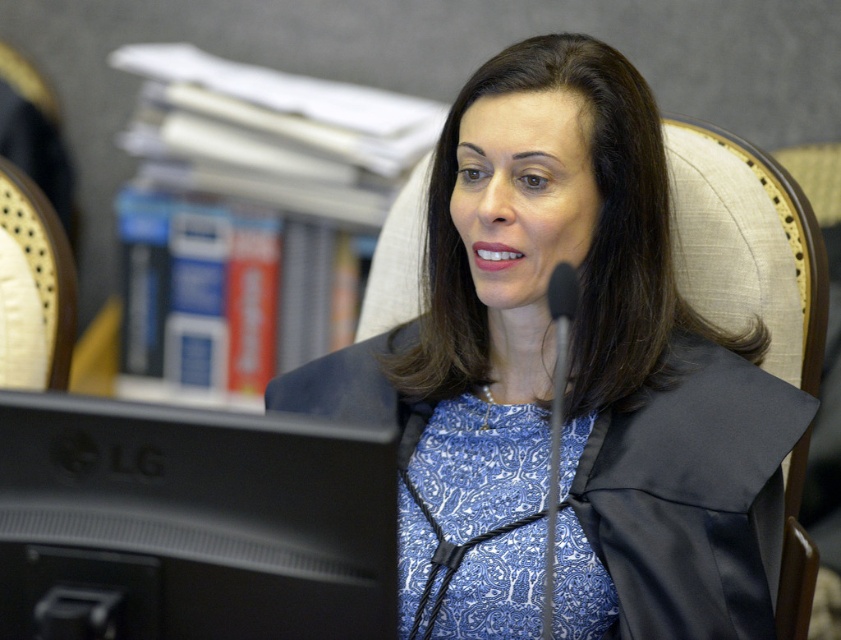
How distant is black matte monitor at lower left from metallic silver microphone at center?

They are 30.16 centimeters apart.

Does point (356, 440) come farther from viewer compared to point (546, 612)?

No, it is in front of (546, 612).

Identify the location of black matte monitor at lower left. This screenshot has width=841, height=640. (194, 518).

In the scene shown: Is blue printed dress at center above black matte monitor at lower left?

Yes, blue printed dress at center is above black matte monitor at lower left.

Can you confirm if blue printed dress at center is bigger than black matte monitor at lower left?

Indeed, blue printed dress at center has a larger size compared to black matte monitor at lower left.

Is point (475, 336) behind point (278, 419)?

That is True.

The width and height of the screenshot is (841, 640). Find the location of `blue printed dress at center`. blue printed dress at center is located at coordinates (556, 243).

What do you see at coordinates (556, 243) in the screenshot?
I see `blue printed dress at center` at bounding box center [556, 243].

Can you confirm if blue printed dress at center is smaller than metallic silver microphone at center?

No.

The image size is (841, 640). I want to click on blue printed dress at center, so click(x=556, y=243).